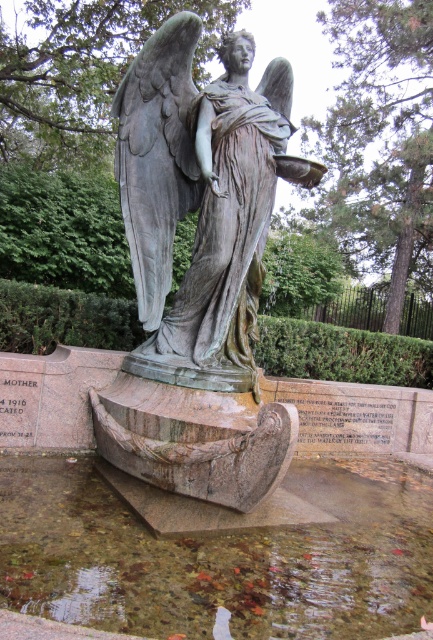
Consider the image. You are a maintenance worker inspecting the statue. You notice the bronze statue at center and the clear glass water at center. Which object is located above the other?

The bronze statue at center is located above the clear glass water at center because the clear glass water at center is positioned under bronze statue at center.